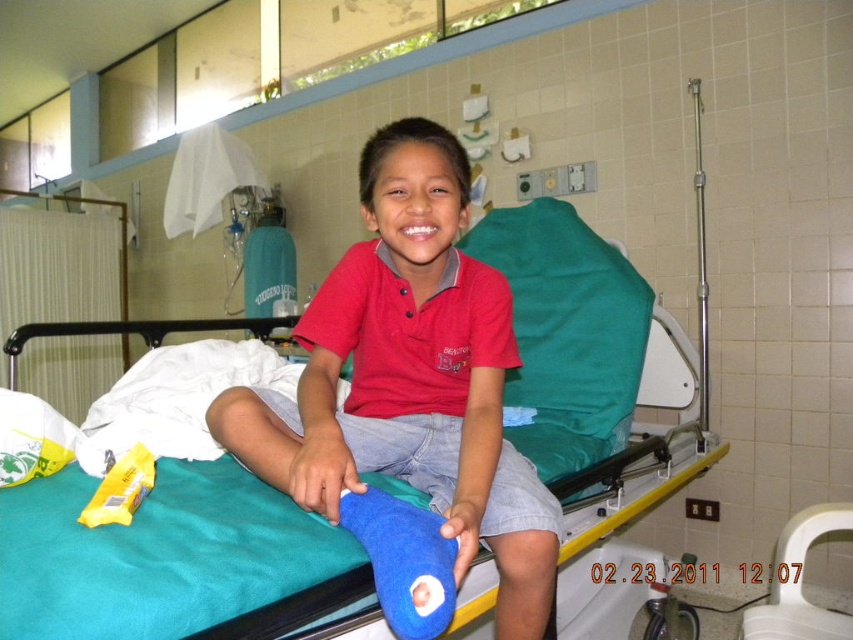
Question: In this image, where is teal fabric hospital bed at center located relative to red cotton shirt at center?

Choices:
 (A) below
 (B) above

Answer: (B)

Question: Among these points, which one is farthest from the camera?

Choices:
 (A) (599, 353)
 (B) (433, 435)

Answer: (A)

Question: From the image, what is the correct spatial relationship of teal fabric hospital bed at center in relation to red cotton shirt at center?

Choices:
 (A) below
 (B) above

Answer: (B)

Question: Which object is farther from the camera taking this photo?

Choices:
 (A) teal fabric hospital bed at center
 (B) red cotton shirt at center

Answer: (A)

Question: Which point is farther to the camera?

Choices:
 (A) red cotton shirt at center
 (B) teal fabric hospital bed at center

Answer: (B)

Question: Is teal fabric hospital bed at center thinner than red cotton shirt at center?

Choices:
 (A) yes
 (B) no

Answer: (A)